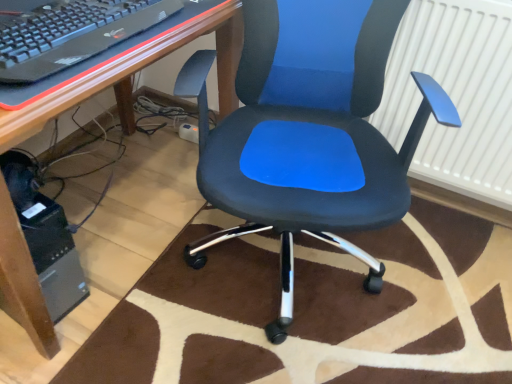
Where is `vacant space underneath brown plush rug at center (from a real-world perspective)`? vacant space underneath brown plush rug at center (from a real-world perspective) is located at coordinates (317, 302).